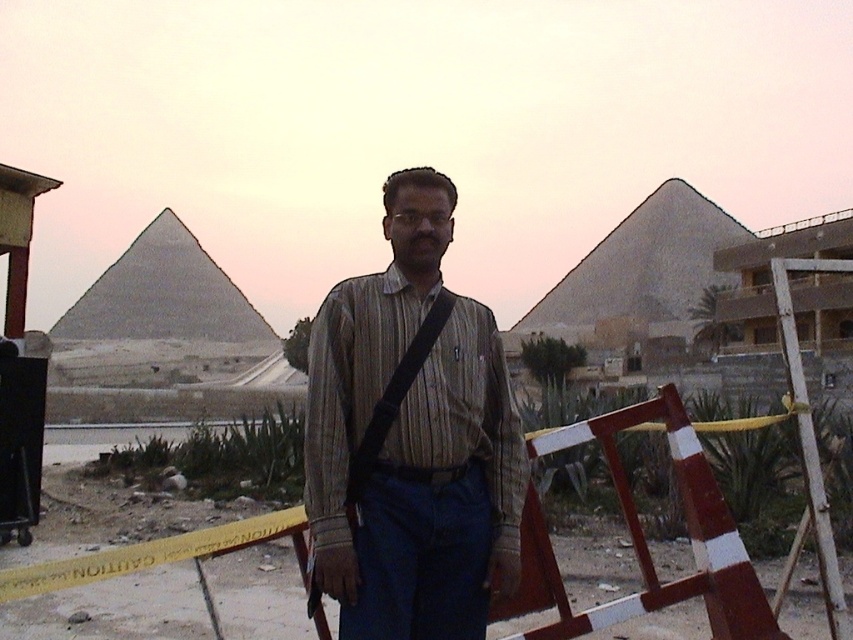
Can you confirm if yellow caution tape at center is positioned to the left of black fabric strap at center?

No, yellow caution tape at center is not to the left of black fabric strap at center.

Is the position of yellow caution tape at center less distant than that of black fabric strap at center?

No, yellow caution tape at center is further to the viewer.

What do you see at coordinates (637, 540) in the screenshot?
I see `yellow caution tape at center` at bounding box center [637, 540].

The image size is (853, 640). Find the location of `yellow caution tape at center`. yellow caution tape at center is located at coordinates (637, 540).

Who is more forward, (683,436) or (128,246)?

Point (683,436)

Does point (436, 241) come in front of point (248, 330)?

Yes, point (436, 241) is closer to viewer.

In order to click on yellow caution tape at center in this screenshot , I will do `click(637, 540)`.

Which is in front, point (401, 616) or point (393, 406)?

Point (401, 616) is more forward.

This screenshot has height=640, width=853. I want to click on striped cotton shirt at center, so click(x=410, y=438).